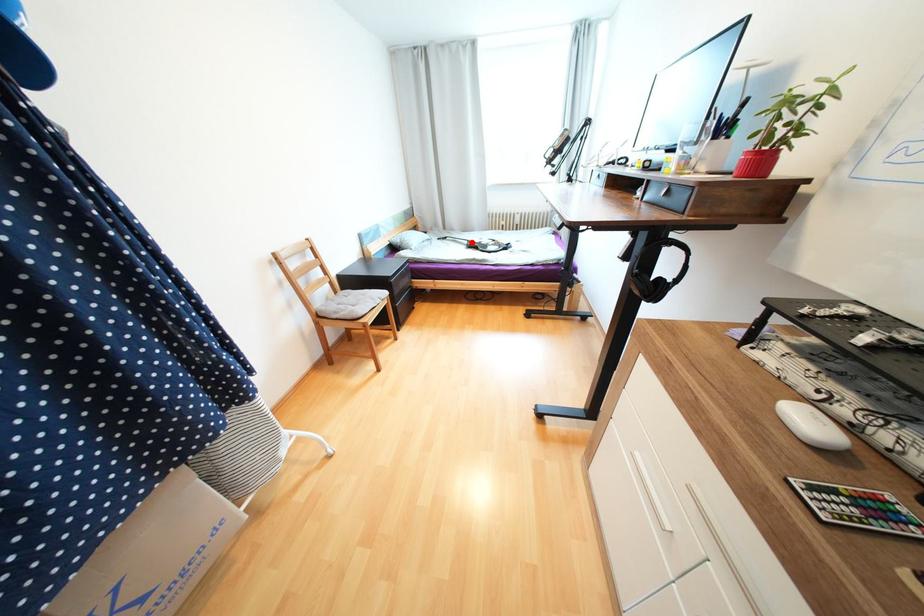
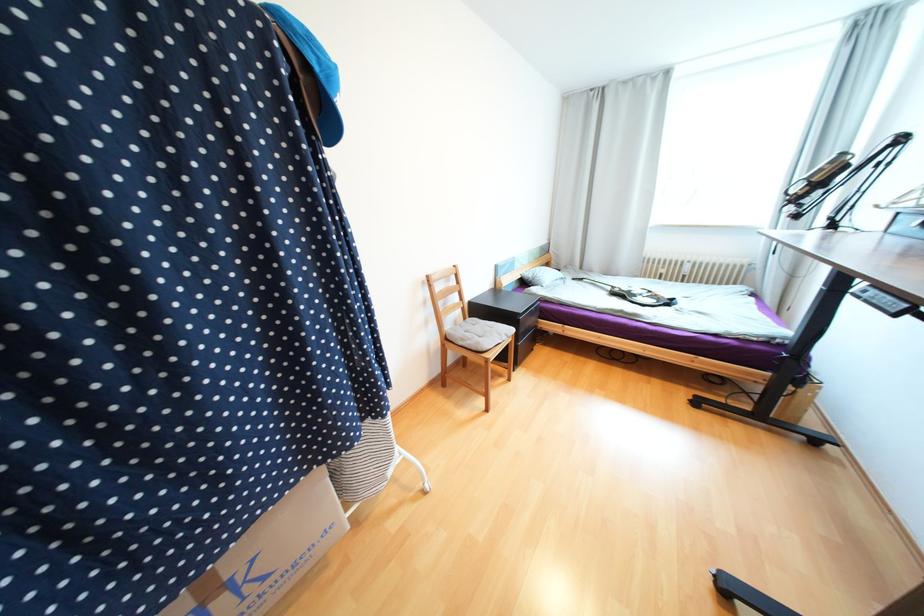
Question: I am providing you with two images of the same scene from different viewpoints. A red point is shown in image1. For the corresponding object point in image2, is it positioned nearer or farther from the camera?

Choices:
 (A) Nearer
 (B) Farther

Answer: (A)